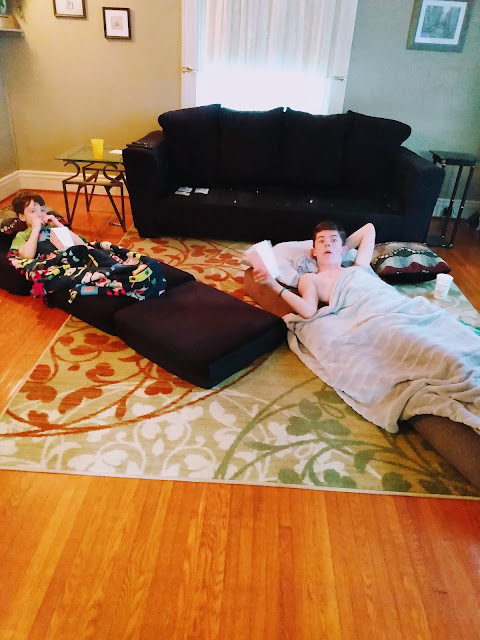
This screenshot has height=640, width=480. Identify the location of cups. (442, 284), (97, 147).